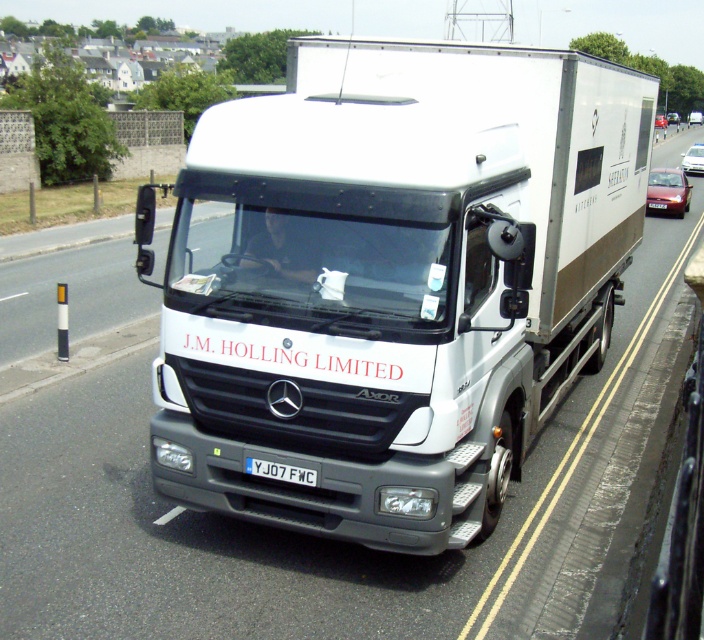
Who is more forward, (353, 460) or (670, 204)?

Positioned in front is point (353, 460).

Does white matte trailer truck at center come behind metallic red car at right?

No.

Is point (260, 124) positioned behind point (689, 196)?

No, (260, 124) is closer to viewer.

Where is `white matte trailer truck at center`? white matte trailer truck at center is located at coordinates (394, 282).

What do you see at coordinates (667, 192) in the screenshot?
I see `metallic red car at right` at bounding box center [667, 192].

Measure the distance between metallic red car at right and camera.

metallic red car at right and camera are 11.67 meters apart.

Identify the location of metallic red car at right. tap(667, 192).

Can you confirm if white matte trailer truck at center is shorter than white plastic license plate at center?

In fact, white matte trailer truck at center may be taller than white plastic license plate at center.

Consider the image. Who is higher up, white matte trailer truck at center or white plastic license plate at center?

white matte trailer truck at center

Is point (508, 122) positioned before point (287, 480)?

No, (508, 122) is further to viewer.

Where is `white matte trailer truck at center`? white matte trailer truck at center is located at coordinates (394, 282).